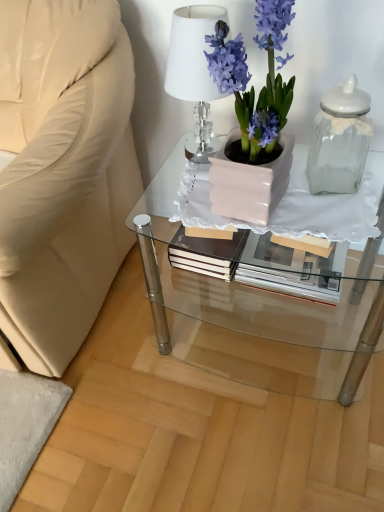
Identify the location of free spot below matte white glass table at center (from a real-world perspective). (264, 334).